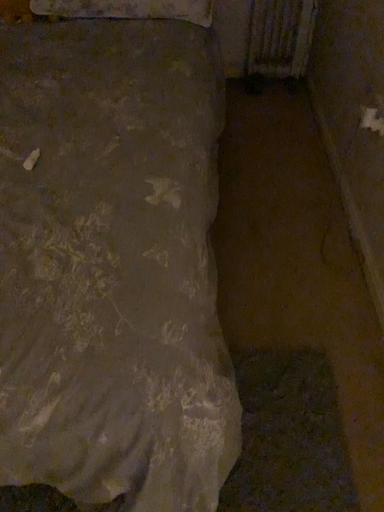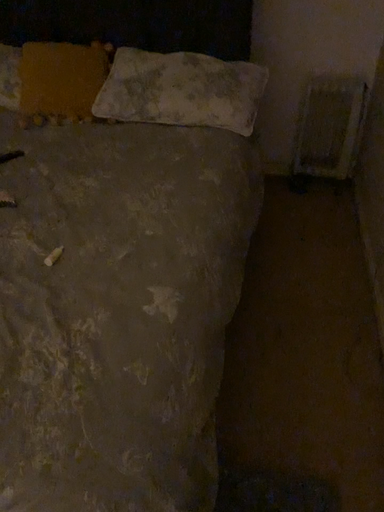
Question: Which way did the camera rotate in the video?

Choices:
 (A) rotated right
 (B) rotated left

Answer: (B)